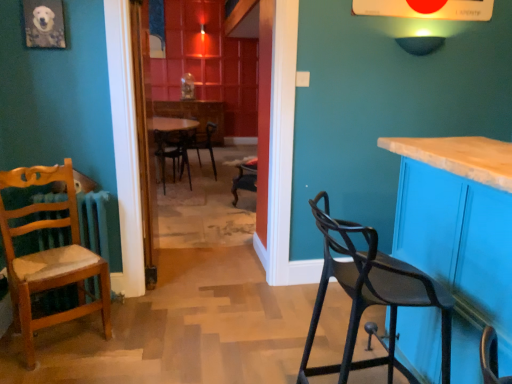
At what (x,y) coordinates should I click in order to perform the action: click on vacant area located to the right-hand side of wooden radiator at left. Please return your answer as a coordinate pair (x, y). The image size is (512, 384). Looking at the image, I should click on (132, 307).